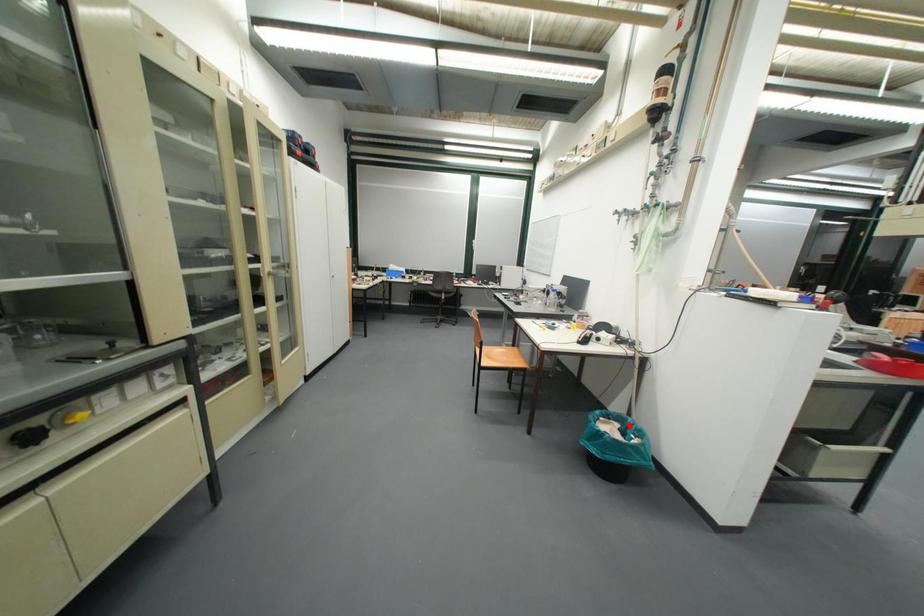
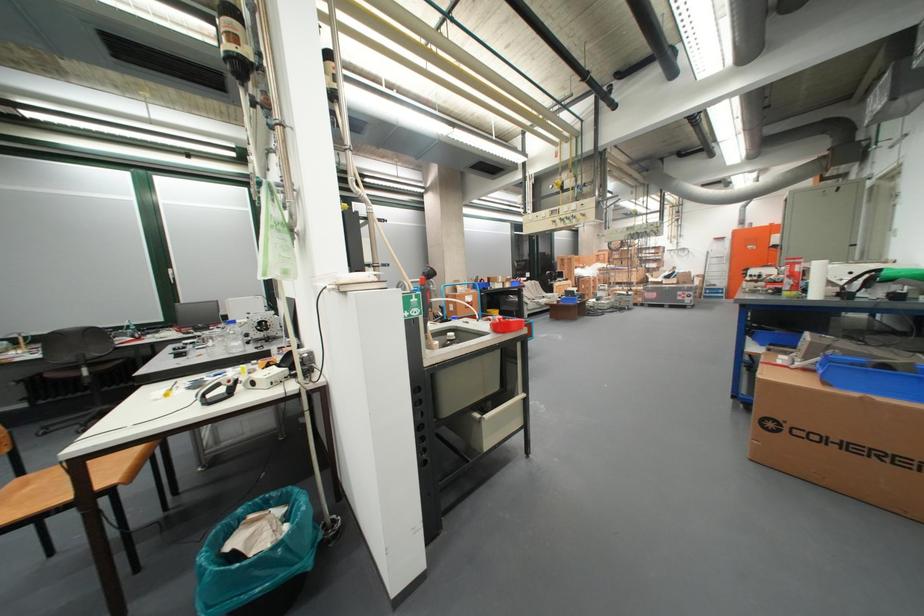
Find the pixel in the second image that matches the highlighted location in the first image.

(293, 512)